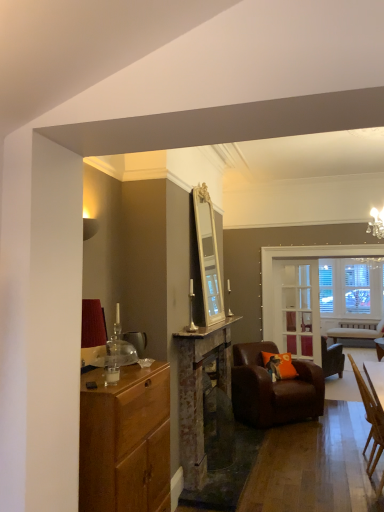
The width and height of the screenshot is (384, 512). What are the coordinates of `rustic stone fireplace at center` in the screenshot? It's located at (199, 391).

Where is `clear glass door at center`? This screenshot has height=512, width=384. clear glass door at center is located at coordinates (297, 308).

In order to face clear glass door at center, should I rotate leftwards or rightwards?

Rotate your view right by about 14.260°.

The height and width of the screenshot is (512, 384). Describe the element at coordinates (207, 329) in the screenshot. I see `marble counter top at center` at that location.

Describe the element at coordinates (279, 365) in the screenshot. The image size is (384, 512). I see `orange fabric pillow at lower center` at that location.

I want to click on rustic stone fireplace at center, so click(x=199, y=391).

How many degrees apart are the facing directions of wooden cabinet at left and light brown wooden chair at lower right, which ranks as the 3th chair in back-to-front order?

2.21 degrees separate the facing orientations of wooden cabinet at left and light brown wooden chair at lower right, which ranks as the 3th chair in back-to-front order.

From a real-world perspective, count 1st chairs downward from the wooden cabinet at left and point to it. Please provide its 2D coordinates.

[(370, 420)]

From the image's perspective, which is below, wooden cabinet at left or light brown wooden chair at lower right, which ranks as the 3th chair in back-to-front order?

light brown wooden chair at lower right, which ranks as the 3th chair in back-to-front order, appears lower in the image.

Can you confirm if wooden cabinet at left is positioned to the left of light brown wooden chair at lower right, which ranks as the 3th chair in back-to-front order?

Yes, wooden cabinet at left is to the left of light brown wooden chair at lower right, which ranks as the 3th chair in back-to-front order.

Is point (245, 414) positioned before point (86, 374)?

No, (245, 414) is behind (86, 374).

Looking at this image, is the position of brown leather armchair at center, which is the second chair in front-to-back order, more distant than that of wooden cabinet at left?

Yes, brown leather armchair at center, which is the second chair in front-to-back order, is further from the viewer.

From the image's perspective, does brown leather armchair at center, which is the second chair in front-to-back order, appear lower than wooden cabinet at left?

Yes, from the image's perspective, brown leather armchair at center, which is the second chair in front-to-back order, is beneath wooden cabinet at left.

Which of these two, brown leather armchair at center, which is the second chair in front-to-back order, or wooden cabinet at left, is wider?

Wider between the two is brown leather armchair at center, which is the second chair in front-to-back order.

From their relative heights in the image, would you say wooden cabinet at left is taller or shorter than rustic stone fireplace at center?

wooden cabinet at left is shorter than rustic stone fireplace at center.

From a real-world perspective, who is located higher, wooden cabinet at left or rustic stone fireplace at center?

rustic stone fireplace at center.

Is wooden cabinet at left directly adjacent to rustic stone fireplace at center?

No, wooden cabinet at left is not touching rustic stone fireplace at center.

Looking at this image, in the image, is rustic stone fireplace at center positioned in front of or behind wooden cabinet at left?

In the image, rustic stone fireplace at center appears behind wooden cabinet at left.

From a real-world perspective, is rustic stone fireplace at center located beneath wooden cabinet at left?

Actually, rustic stone fireplace at center is physically above wooden cabinet at left in the real world.

There is a wooden cabinet at left. Where is `fireplace above it (from a real-world perspective)`? This screenshot has height=512, width=384. fireplace above it (from a real-world perspective) is located at coordinates (199, 391).

Is rustic stone fireplace at center inside the boundaries of wooden cabinet at left, or outside?

rustic stone fireplace at center is located beyond the bounds of wooden cabinet at left.

Looking at the image, does orange fabric pillow at lower center seem bigger or smaller compared to rustic stone fireplace at center?

Considering their sizes, orange fabric pillow at lower center takes up less space than rustic stone fireplace at center.

Where is `fireplace above the orange fabric pillow at lower center (from the image's perspective)`? The image size is (384, 512). fireplace above the orange fabric pillow at lower center (from the image's perspective) is located at coordinates (199, 391).

Who is taller, orange fabric pillow at lower center or rustic stone fireplace at center?

rustic stone fireplace at center.

Is orange fabric pillow at lower center spatially inside rustic stone fireplace at center, or outside of it?

orange fabric pillow at lower center is spatially situated outside rustic stone fireplace at center.

Who is smaller, brown leather armchair at center, placed as the 1th chair when sorted from back to front, or orange fabric pillow at lower center?

Smaller between the two is orange fabric pillow at lower center.

Does brown leather armchair at center, the third chair when ordered from front to back, appear on the right side of orange fabric pillow at lower center?

Indeed, brown leather armchair at center, the third chair when ordered from front to back, is positioned on the right side of orange fabric pillow at lower center.

In the scene shown: Considering the relative sizes of brown leather armchair at center, placed as the 1th chair when sorted from back to front, and orange fabric pillow at lower center in the image provided, is brown leather armchair at center, placed as the 1th chair when sorted from back to front, shorter than orange fabric pillow at lower center?

No.

Is brown leather armchair at center, the third chair when ordered from front to back, looking in the opposite direction of orange fabric pillow at lower center?

Yes, brown leather armchair at center, the third chair when ordered from front to back,'s orientation is away from orange fabric pillow at lower center.

Looking at their sizes, would you say rustic stone fireplace at center is wider or thinner than marble counter top at center?

In the image, rustic stone fireplace at center appears to be wider than marble counter top at center.

How different are the orientations of rustic stone fireplace at center and marble counter top at center in degrees?

The angular difference between rustic stone fireplace at center and marble counter top at center is 0.263 degrees.

From a real-world perspective, does rustic stone fireplace at center sit lower than marble counter top at center?

Yes.

From the image's perspective, starting from the wooden cabinet at left, which chair is the 1st one below? Please provide its 2D coordinates.

[(370, 420)]

Locate an element on the screen. The image size is (384, 512). cabinetry above the brown leather armchair at center, which is the second chair in front-to-back order (from a real-world perspective) is located at coordinates (125, 441).

From the image, which object appears to be nearer to rustic stone fireplace at center, light brown wooden chair at lower right, the first chair positioned from the front, or clear glass door at center?

light brown wooden chair at lower right, the first chair positioned from the front.

Considering their positions, is brown leather armchair at center, placed as the 1th chair when sorted from back to front, positioned further to brown leather armchair at center, the 2th chair viewed from the back, than rustic stone fireplace at center?

brown leather armchair at center, placed as the 1th chair when sorted from back to front, is further to brown leather armchair at center, the 2th chair viewed from the back.

Based on their spatial positions, is light brown wooden chair at lower right, the first chair positioned from the front, or rustic stone fireplace at center closer to brown leather armchair at center, the 2th chair viewed from the back?

rustic stone fireplace at center lies closer to brown leather armchair at center, the 2th chair viewed from the back, than the other object.

Consider the image. Which object lies further to the anchor point marble counter top at center, brown leather armchair at center, which is the second chair in front-to-back order, or brown leather armchair at center, the third chair when ordered from front to back?

brown leather armchair at center, the third chair when ordered from front to back, lies further to marble counter top at center than the other object.

Which object lies nearer to the anchor point orange fabric pillow at lower center, light brown wooden chair at lower right, which ranks as the 3th chair in back-to-front order, or marble counter top at center?

marble counter top at center is positioned closer to the anchor orange fabric pillow at lower center.

Based on their spatial positions, is marble counter top at center or light brown wooden chair at lower right, the first chair positioned from the front, closer to orange fabric pillow at lower center?

marble counter top at center lies closer to orange fabric pillow at lower center than the other object.

From the picture: Considering their positions, is marble counter top at center positioned closer to wooden cabinet at left than light brown wooden chair at lower right, the first chair positioned from the front?

marble counter top at center is closer to wooden cabinet at left.

When comparing their distances from rustic stone fireplace at center, does brown leather armchair at center, the 2th chair viewed from the back, or clear glass door at center seem closer?

brown leather armchair at center, the 2th chair viewed from the back, lies closer to rustic stone fireplace at center than the other object.

Where is `counter top between wooden cabinet at left and brown leather armchair at center, the 2th chair viewed from the back, in the front-back direction`? Image resolution: width=384 pixels, height=512 pixels. counter top between wooden cabinet at left and brown leather armchair at center, the 2th chair viewed from the back, in the front-back direction is located at coordinates (207, 329).

The image size is (384, 512). I want to click on pillow between marble counter top at center and brown leather armchair at center, the third chair when ordered from front to back, from front to back, so click(x=279, y=365).

Image resolution: width=384 pixels, height=512 pixels. In order to click on glass door between light brown wooden chair at lower right, the first chair positioned from the front, and brown leather armchair at center, the third chair when ordered from front to back, in the front-back direction in this screenshot , I will do `click(297, 308)`.

This screenshot has height=512, width=384. What are the coordinates of `fireplace located between wooden cabinet at left and brown leather armchair at center, the 2th chair viewed from the back, in the depth direction` in the screenshot? It's located at (199, 391).